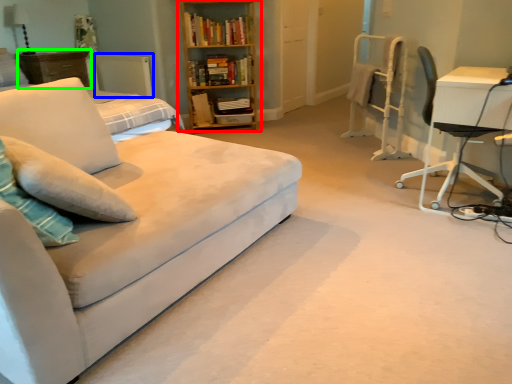
Question: Which object is positioned farthest from bookcase (highlighted by a red box)? Select from radiator (highlighted by a blue box) and dresser (highlighted by a green box).

Choices:
 (A) radiator
 (B) dresser

Answer: (B)